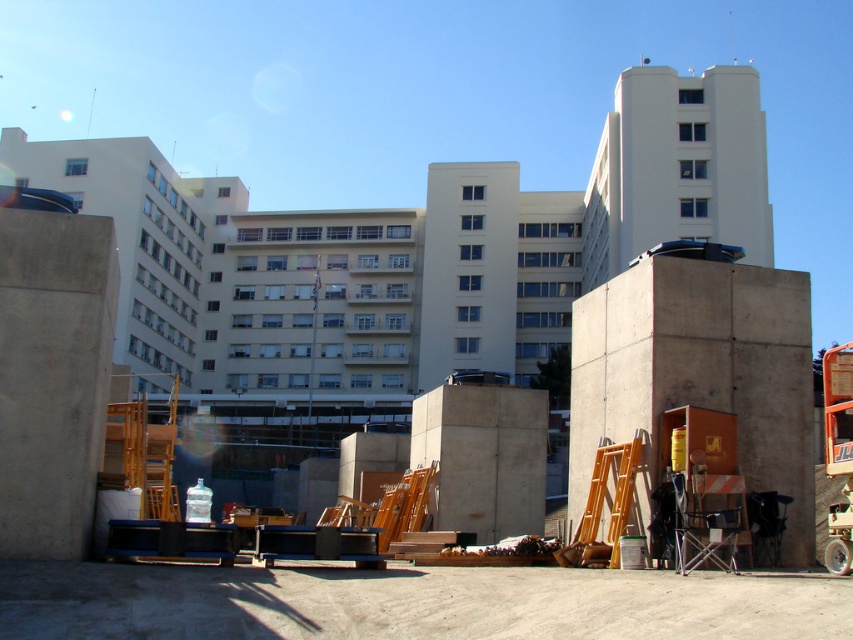
From the picture: Which of these two, concrete rough at lower center or concreteroughblock at right, stands shorter?

concrete rough at lower center

Between point (700, 604) and point (769, 376), which one is positioned behind?

Positioned behind is point (769, 376).

Describe the element at coordinates (410, 602) in the screenshot. I see `concrete rough at lower center` at that location.

This screenshot has height=640, width=853. What are the coordinates of `concrete rough at lower center` in the screenshot? It's located at (410, 602).